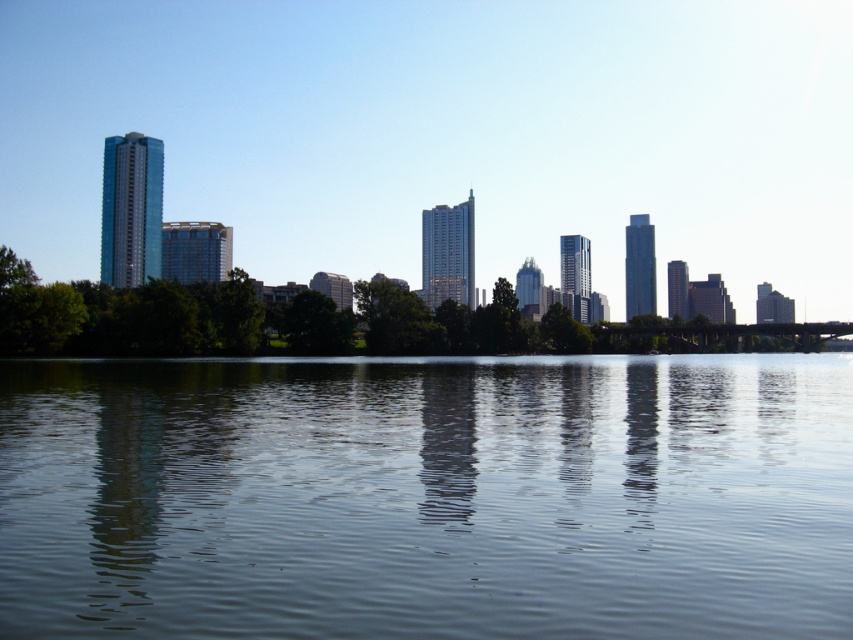
You are standing on the bridge and looking at the clear water at center and the green leafy tree at center. Which object appears taller from your perspective?

The green leafy tree at center appears taller than the clear water at center because the clear water at center is shorter than green leafy tree at center.

You are standing on the bridge and want to place a small floating decoration on the water. Which object, the clear water at center or the green leafy tree at center, can the decoration be placed on?

The decoration can be placed on the clear water at center because it has a larger size compared to the green leafy tree at center.

You are standing on the bridge and want to place a small boat in the scene. The boat requires a space wider than the green leafy tree at center to float. Can the clear water at center accommodate the boat?

The clear water at center has a width larger than the green leafy tree at center, so yes, the boat can float there as it provides sufficient space.